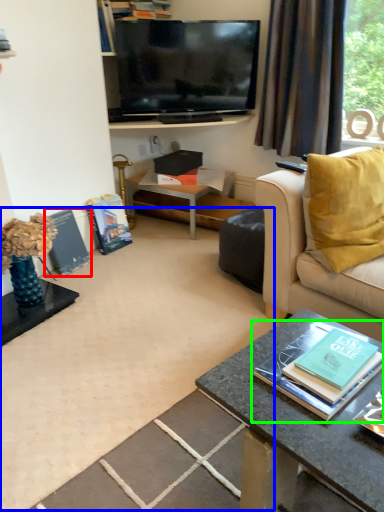
Question: Which object is positioned closest to magazine (highlighted by a red box)? Select from plain (highlighted by a blue box) and book (highlighted by a green box).

Choices:
 (A) plain
 (B) book

Answer: (A)